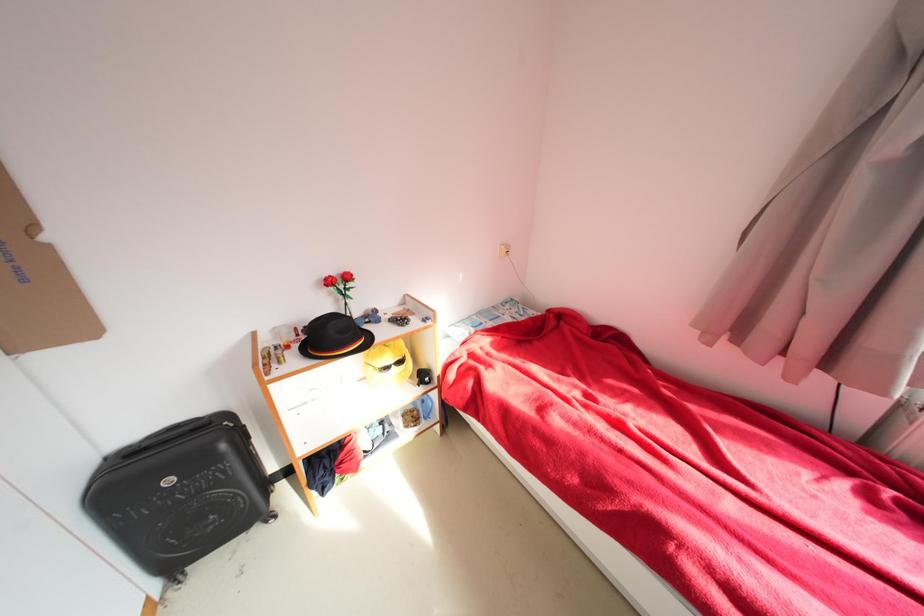
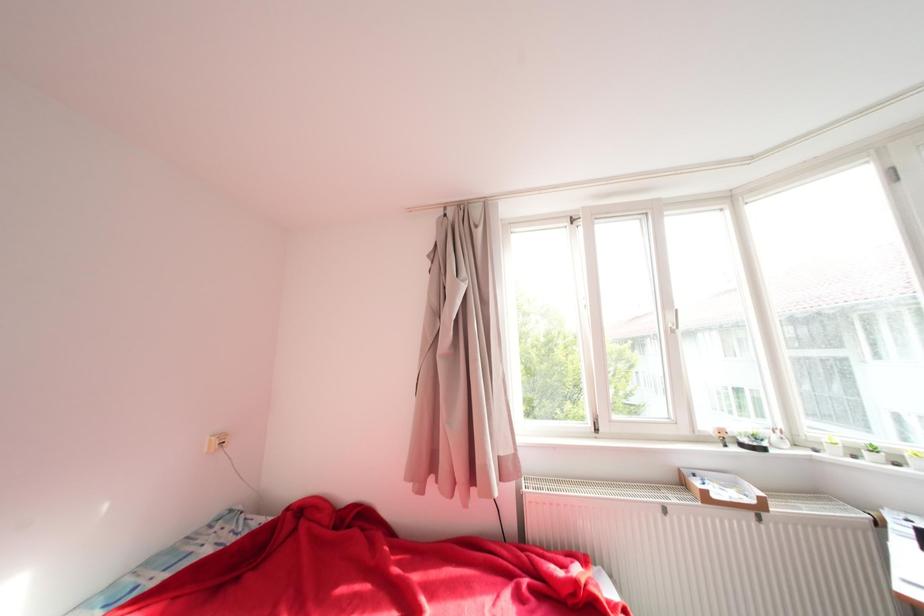
The first image is from the beginning of the video and the second image is from the end. How did the camera likely rotate when shooting the video?

The camera's rotation is toward right-up.